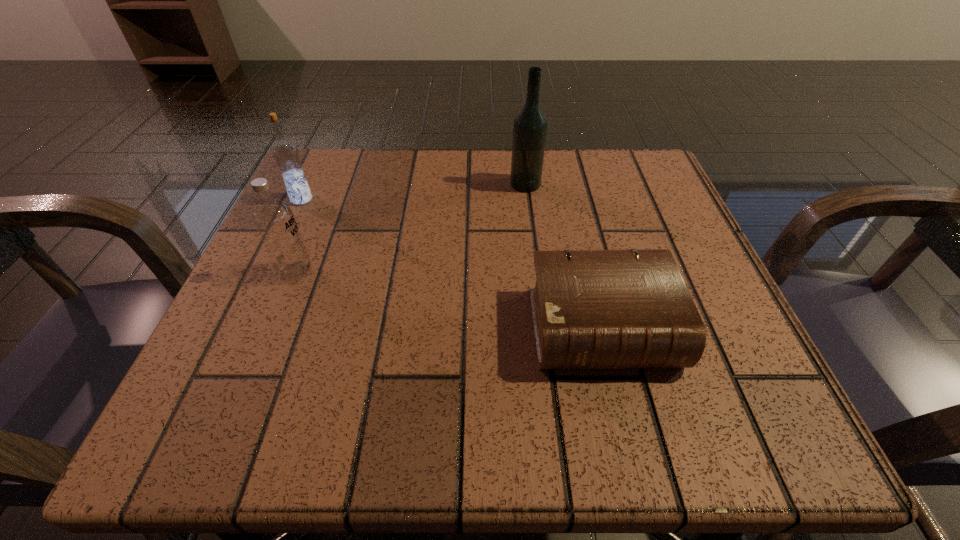
Image resolution: width=960 pixels, height=540 pixels. I want to click on the rightmost vodka, so click(x=530, y=125).

The height and width of the screenshot is (540, 960). What are the coordinates of `the tallest vodka` in the screenshot? It's located at (530, 125).

At what (x,y) coordinates should I click in order to perform the action: click on the second nearest object. Please return your answer as a coordinate pair (x, y). Looking at the image, I should click on (273, 218).

You are a GUI agent. You are given a task and a screenshot of the screen. Output one action in this format:
    pyautogui.click(x=<x>, y=<y>)
    Task: Click on the nearest object
    
    Given the screenshot: What is the action you would take?
    pyautogui.click(x=591, y=309)

At what (x,y) coordinates should I click in order to perform the action: click on the shortest object. Please return your answer as a coordinate pair (x, y). The image size is (960, 540). Looking at the image, I should click on (591, 309).

You are a GUI agent. You are given a task and a screenshot of the screen. Output one action in this format:
    pyautogui.click(x=<x>, y=<y>)
    Task: Click on the free region located on the right of the tallest object
    The width and height of the screenshot is (960, 540).
    Given the screenshot: What is the action you would take?
    pyautogui.click(x=585, y=184)

Locate an element on the screen. The image size is (960, 540). free spot located 0.320m on the front label of the second nearest object is located at coordinates (508, 272).

Identify the location of free point located 0.090m on the spine side of the Bible. Image resolution: width=960 pixels, height=540 pixels. (630, 444).

Where is `object that is at the right edge`? This screenshot has height=540, width=960. object that is at the right edge is located at coordinates (591, 309).

This screenshot has width=960, height=540. What are the coordinates of `object that is positioned at the far left corner` in the screenshot? It's located at (286, 155).